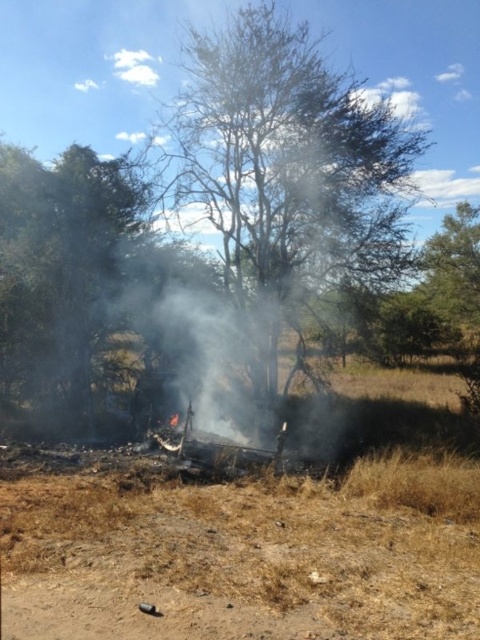
Question: Is brown dry grass at lower center bigger than brown leafy tree at center?

Choices:
 (A) yes
 (B) no

Answer: (B)

Question: Among these points, which one is nearest to the camera?

Choices:
 (A) (262, 100)
 (B) (314, 486)

Answer: (B)

Question: Is brown dry grass at lower center above green leafy tree at left?

Choices:
 (A) no
 (B) yes

Answer: (A)

Question: Is brown dry grass at lower center to the right of green leafy tree at left from the viewer's perspective?

Choices:
 (A) yes
 (B) no

Answer: (A)

Question: Estimate the real-world distances between objects in this image. Which object is closer to the green leafy tree at left?

Choices:
 (A) brown leafy tree at center
 (B) brown dry grass at lower center

Answer: (A)

Question: Which point is farther to the camera?

Choices:
 (A) (180, 625)
 (B) (36, 179)

Answer: (B)